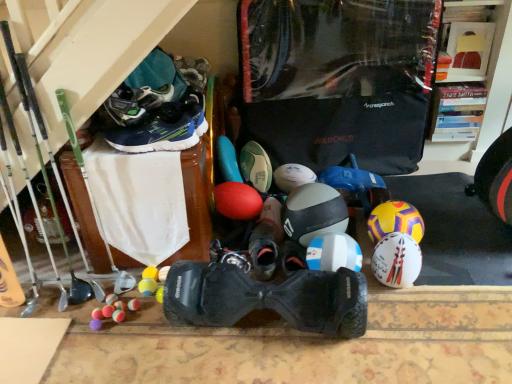
Question: Could green synthetic running shoe at upper left, which is the 3th footwear in front-to-back order, be considered to be inside white matte soccer ball at center?

Choices:
 (A) no
 (B) yes

Answer: (A)

Question: Can you confirm if white matte soccer ball at center is taller than green synthetic running shoe at upper left, which is the 3th footwear in front-to-back order?

Choices:
 (A) yes
 (B) no

Answer: (A)

Question: Is white matte soccer ball at center oriented away from green synthetic running shoe at upper left, which is the 3th footwear in front-to-back order?

Choices:
 (A) yes
 (B) no

Answer: (B)

Question: Is white matte soccer ball at center at the left side of green synthetic running shoe at upper left, which is the 3th footwear in front-to-back order?

Choices:
 (A) no
 (B) yes

Answer: (A)

Question: Would you say white matte soccer ball at center is outside green synthetic running shoe at upper left, the third footwear when ordered from back to front?

Choices:
 (A) no
 (B) yes

Answer: (B)

Question: From a real-world perspective, is white matte soccer ball at center below green synthetic running shoe at upper left, which is the 3th footwear in front-to-back order?

Choices:
 (A) yes
 (B) no

Answer: (A)

Question: Considering the relative sizes of black rubber hoverboard at center, positioned as the 1th footwear in front-to-back order, and white matte soccer ball at center in the image provided, is black rubber hoverboard at center, positioned as the 1th footwear in front-to-back order, taller than white matte soccer ball at center?

Choices:
 (A) yes
 (B) no

Answer: (A)

Question: Is black rubber hoverboard at center, positioned as the 1th footwear in front-to-back order, facing away from white matte soccer ball at center?

Choices:
 (A) yes
 (B) no

Answer: (A)

Question: Is black rubber hoverboard at center, positioned as the 1th footwear in front-to-back order, smaller than white matte soccer ball at center?

Choices:
 (A) no
 (B) yes

Answer: (A)

Question: From a real-world perspective, is black rubber hoverboard at center, positioned as the 1th footwear in front-to-back order, physically below white matte soccer ball at center?

Choices:
 (A) no
 (B) yes

Answer: (A)

Question: Can you confirm if black rubber hoverboard at center, marked as the 5th footwear in a back-to-front arrangement, is positioned to the right of white matte soccer ball at center?

Choices:
 (A) no
 (B) yes

Answer: (A)

Question: Considering the relative positions of black rubber hoverboard at center, marked as the 5th footwear in a back-to-front arrangement, and white matte soccer ball at center in the image provided, is black rubber hoverboard at center, marked as the 5th footwear in a back-to-front arrangement, to the left of white matte soccer ball at center from the viewer's perspective?

Choices:
 (A) yes
 (B) no

Answer: (A)

Question: Is black rubber hoverboard at center, marked as the 5th footwear in a back-to-front arrangement, taller than white matte helmet at center, which ranks as the third helmet in left-to-right order?

Choices:
 (A) yes
 (B) no

Answer: (A)